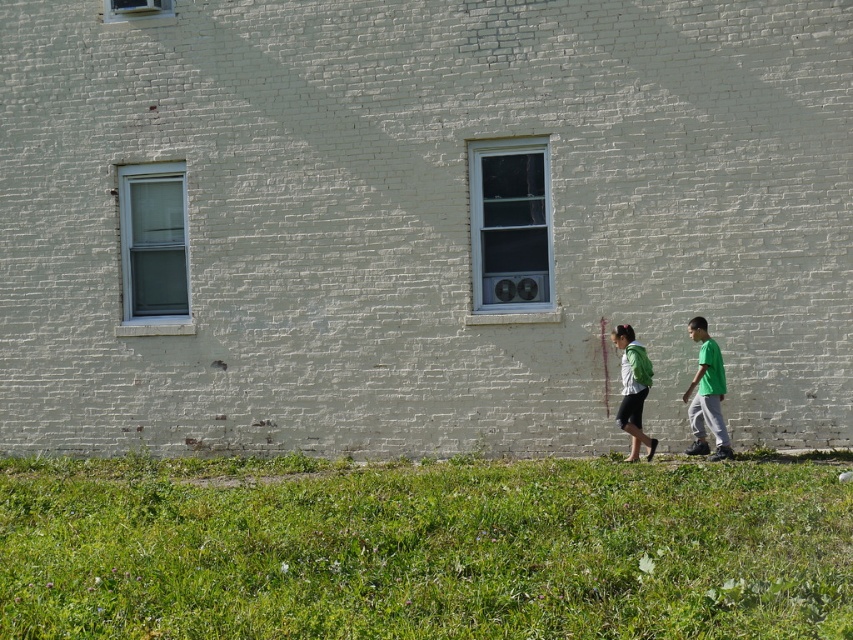
Can you confirm if green matte shirt at right is thinner than green matte backpack at lower right?

Incorrect, green matte shirt at right's width is not less than green matte backpack at lower right's.

In the scene shown: Can you confirm if green matte shirt at right is smaller than green matte backpack at lower right?

Yes, green matte shirt at right is smaller than green matte backpack at lower right.

Who is more forward, (715, 380) or (642, 396)?

Point (715, 380)

Where is `green matte shirt at right`? green matte shirt at right is located at coordinates (706, 396).

Measure the distance between green grass at lower center and camera.

They are 6.02 meters apart.

Can you confirm if green grass at lower center is positioned to the right of green matte shirt at right?

No, green grass at lower center is not to the right of green matte shirt at right.

This screenshot has width=853, height=640. I want to click on green grass at lower center, so click(426, 552).

Is green grass at lower center positioned behind green matte backpack at lower right?

No, it is not.

Does point (503, 468) come closer to viewer compared to point (630, 456)?

Yes.

Which is behind, point (788, 465) or point (654, 442)?

The point (654, 442) is more distant.

In order to click on green grass at lower center in this screenshot , I will do (426, 552).